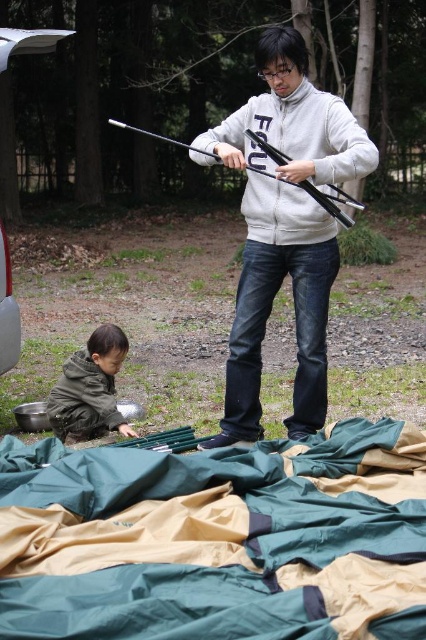
Does white matte jacket at center have a smaller size compared to dark green fabric at lower left?

No.

Between point (319, 340) and point (97, 353), which one is positioned behind?

Point (97, 353)

The width and height of the screenshot is (426, 640). What are the coordinates of `white matte jacket at center` in the screenshot? It's located at click(x=284, y=228).

Can you confirm if dark green fabric at lower left is positioned below metallic silver minivan at lower left?

Correct, dark green fabric at lower left is located below metallic silver minivan at lower left.

Can you confirm if dark green fabric at lower left is shorter than metallic silver minivan at lower left?

Yes, dark green fabric at lower left is shorter than metallic silver minivan at lower left.

Identify the location of dark green fabric at lower left. (89, 388).

Is point (17, 602) positioned in front of point (115, 400)?

That is True.

Can you confirm if green fabric blanket at lower center is shorter than dark green fabric at lower left?

Correct, green fabric blanket at lower center is not as tall as dark green fabric at lower left.

Describe the element at coordinates (216, 538) in the screenshot. This screenshot has width=426, height=640. I see `green fabric blanket at lower center` at that location.

The height and width of the screenshot is (640, 426). I want to click on green fabric blanket at lower center, so click(x=216, y=538).